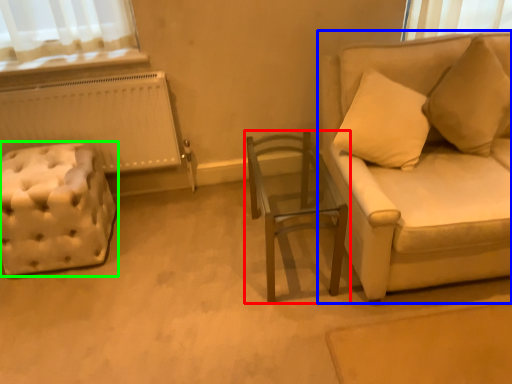
Question: Based on their relative distances, which object is farther from table (highlighted by a red box)? Choose from studio couch (highlighted by a blue box) and furniture (highlighted by a green box).

Choices:
 (A) studio couch
 (B) furniture

Answer: (B)